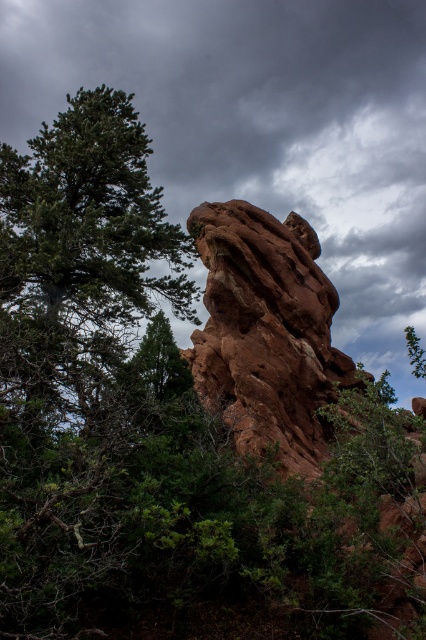
Based on the photo, does green matte tree at center have a greater width compared to green matte tree at upper center?

No.

At what (x,y) coordinates should I click in order to perform the action: click on green matte tree at center. Please return your answer as a coordinate pair (x, y). Looking at the image, I should click on (157, 364).

At what (x,y) coordinates should I click in order to perform the action: click on green matte tree at center. Please return your answer as a coordinate pair (x, y). This screenshot has width=426, height=640. Looking at the image, I should click on (157, 364).

Based on the photo, does rustic stone rock at center appear over green matte tree at upper center?

Correct, rustic stone rock at center is located above green matte tree at upper center.

The height and width of the screenshot is (640, 426). Describe the element at coordinates (267, 332) in the screenshot. I see `rustic stone rock at center` at that location.

Where is `rustic stone rock at center`? This screenshot has width=426, height=640. rustic stone rock at center is located at coordinates (267, 332).

Image resolution: width=426 pixels, height=640 pixels. I want to click on rustic stone rock at center, so click(267, 332).

Does green matte tree at upper left have a smaller size compared to green matte tree at center?

Incorrect, green matte tree at upper left is not smaller in size than green matte tree at center.

Is green matte tree at upper left closer to the viewer compared to green matte tree at center?

Yes.

Is point (157, 196) farther from camera compared to point (138, 376)?

Yes, it is behind point (138, 376).

At what (x,y) coordinates should I click in order to perform the action: click on green matte tree at upper left. Please return your answer as a coordinate pair (x, y). Looking at the image, I should click on (78, 259).